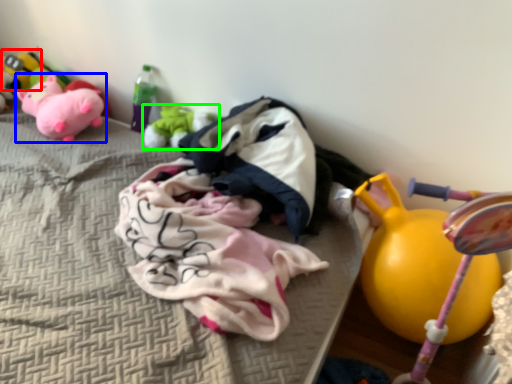
Question: Based on their relative distances, which object is farther from toy (highlighted by a red box)? Choose from toy (highlighted by a blue box) and toy (highlighted by a green box).

Choices:
 (A) toy
 (B) toy

Answer: (B)